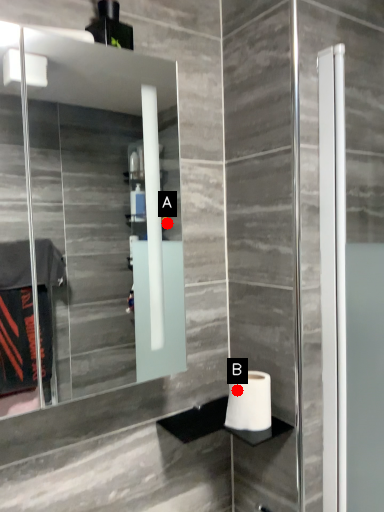
Question: Two points are circled on the image, labeled by A and B beside each circle. Among these points, which one is farthest from the camera?

Choices:
 (A) A is further
 (B) B is further

Answer: (A)